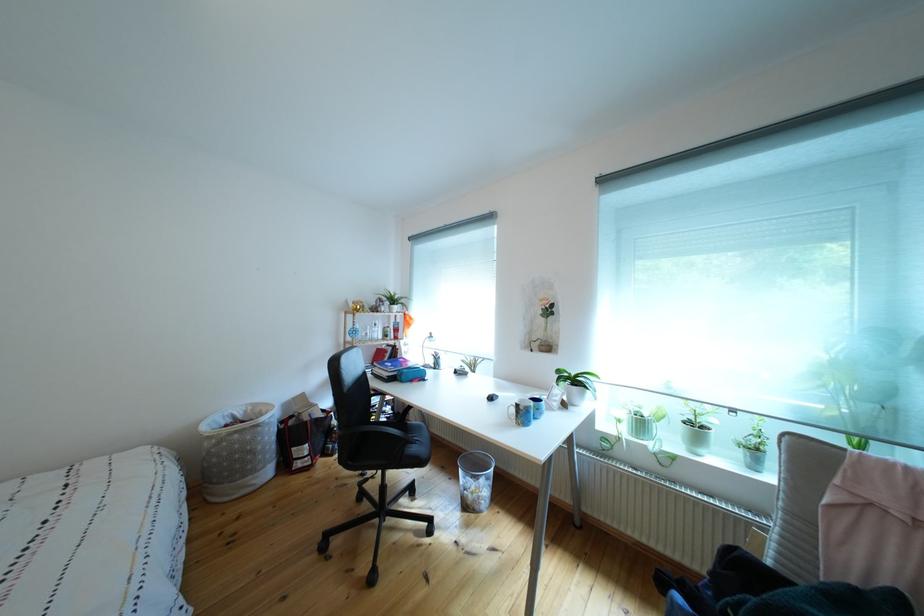
I want to click on white spray bottle, so click(x=553, y=397).